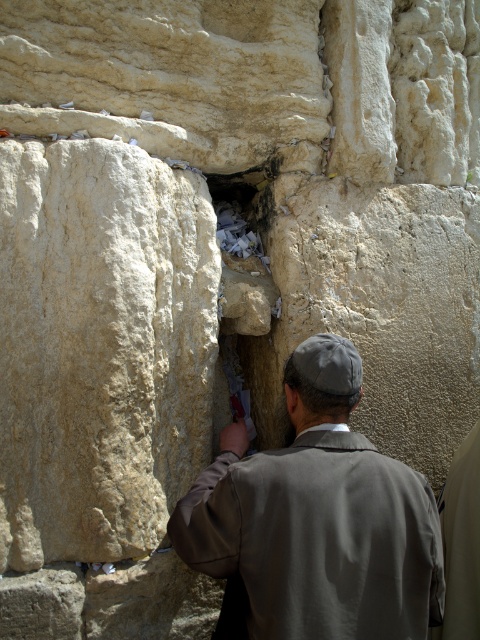
Question: Among these objects, which one is nearest to the camera?

Choices:
 (A) gray fabric jacket at center
 (B) white paper at center

Answer: (A)

Question: Which point is closer to the camera taking this photo?

Choices:
 (A) (235, 237)
 (B) (324, 522)

Answer: (B)

Question: Does gray fabric jacket at center lie in front of white paper at center?

Choices:
 (A) no
 (B) yes

Answer: (B)

Question: Which point is closer to the camera taking this photo?

Choices:
 (A) (244, 182)
 (B) (269, 576)

Answer: (B)

Question: Can you confirm if gray fabric jacket at center is positioned above white paper at center?

Choices:
 (A) yes
 (B) no

Answer: (B)

Question: Can you confirm if gray fabric jacket at center is positioned below white paper at center?

Choices:
 (A) yes
 (B) no

Answer: (A)